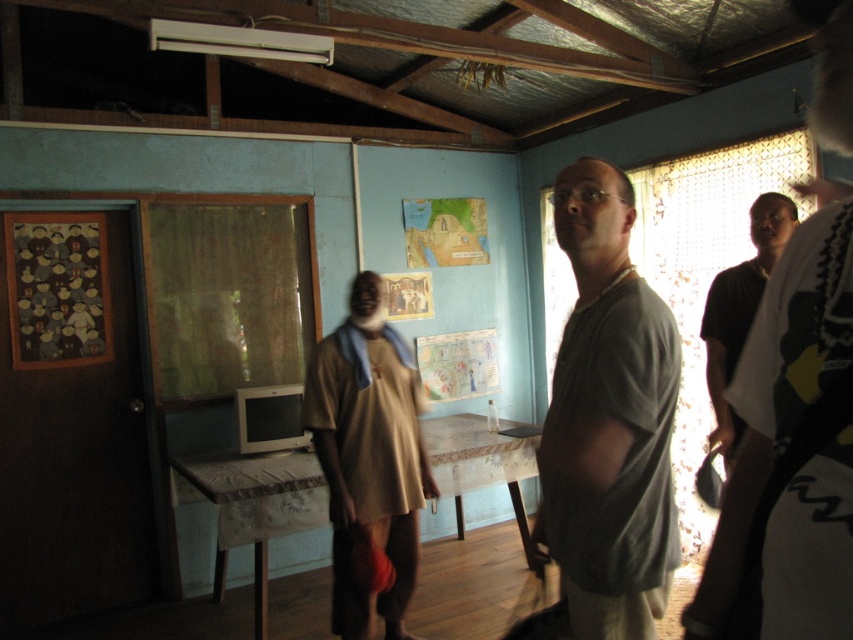
You are standing in the room and see the brown fabric dress at center. There is a red leather jacket hanging on a hook 9 feet away. Can you reach the jacket from where you are standing without moving?

The brown fabric dress at center and the red leather jacket are 9.06 feet apart. Since the distance is over 9 feet, you cannot reach the jacket without moving closer.

You are standing in the room and want to place a new painting on the wall. The painting is 0.5 meters wide. The brown fabric dress at center is currently occupying space at point 0.720, 0.433. Can you place the painting without overlapping the dress?

The brown fabric dress at center is located at point (368, 460). Since the painting is 0.5 meters wide, you need to ensure there is enough space on the wall away from that coordinate to avoid overlapping. However, without knowing the exact dimensions of the wall and the dress, it is difficult to confirm. Please check the available space around the specified point.